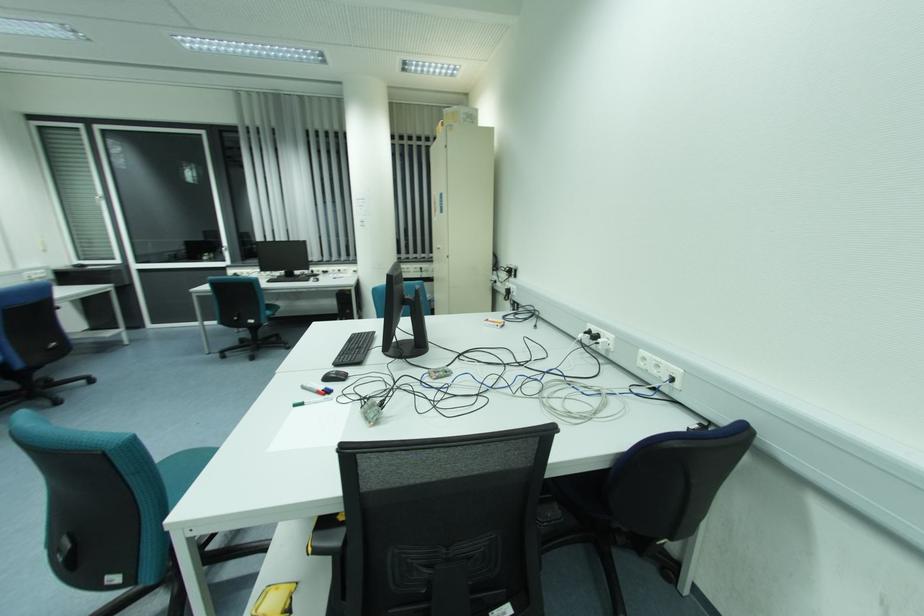
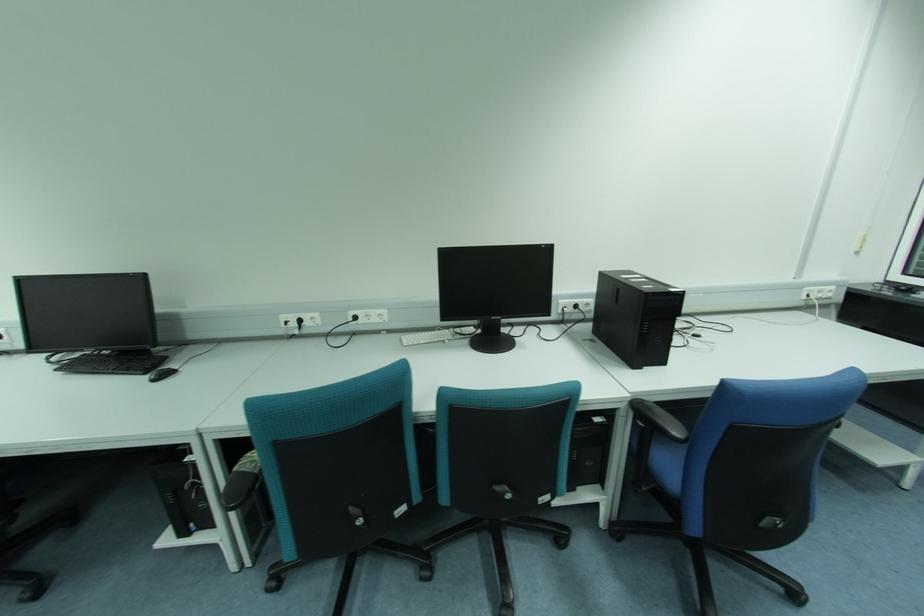
Locate, in the second image, the point that corresponds to (43,272) in the first image.

(833, 288)